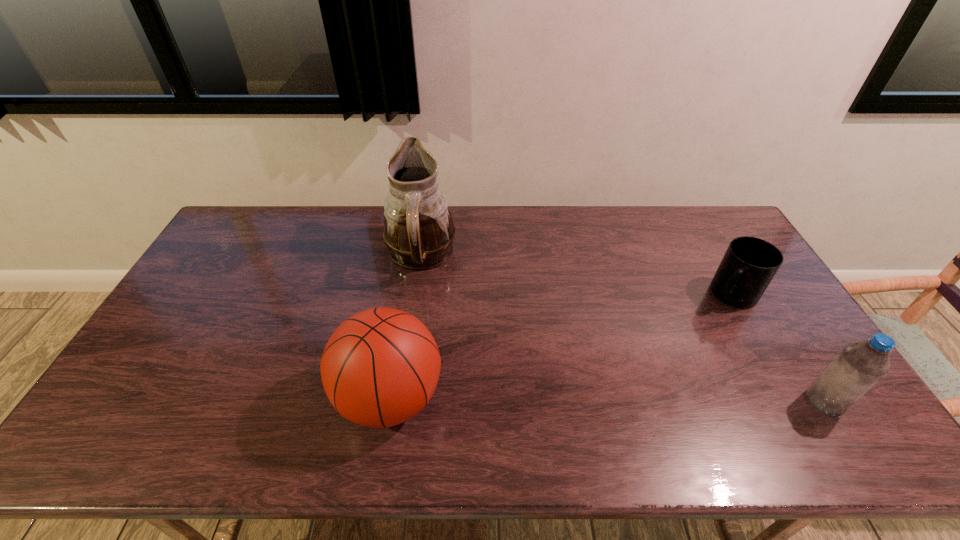
This screenshot has width=960, height=540. What are the coordinates of `free spot on the desktop that is between the basketball and the water bottle and is positioned from the spout of the tallest object` in the screenshot? It's located at (591, 400).

Locate an element on the screen. This screenshot has height=540, width=960. vacant space on the desktop that is between the basketball and the water bottle and is positioned on the side of the mug with the handle is located at coordinates (636, 400).